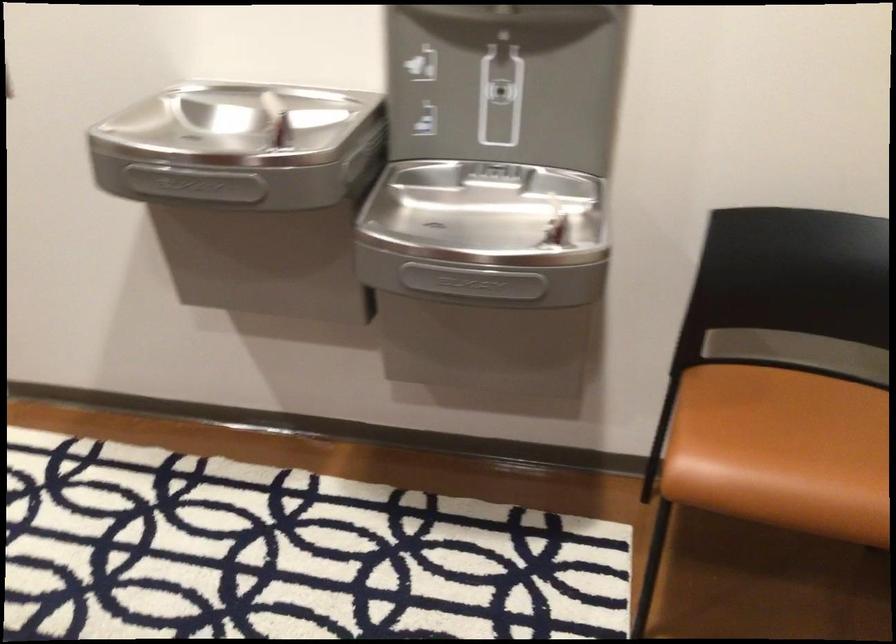
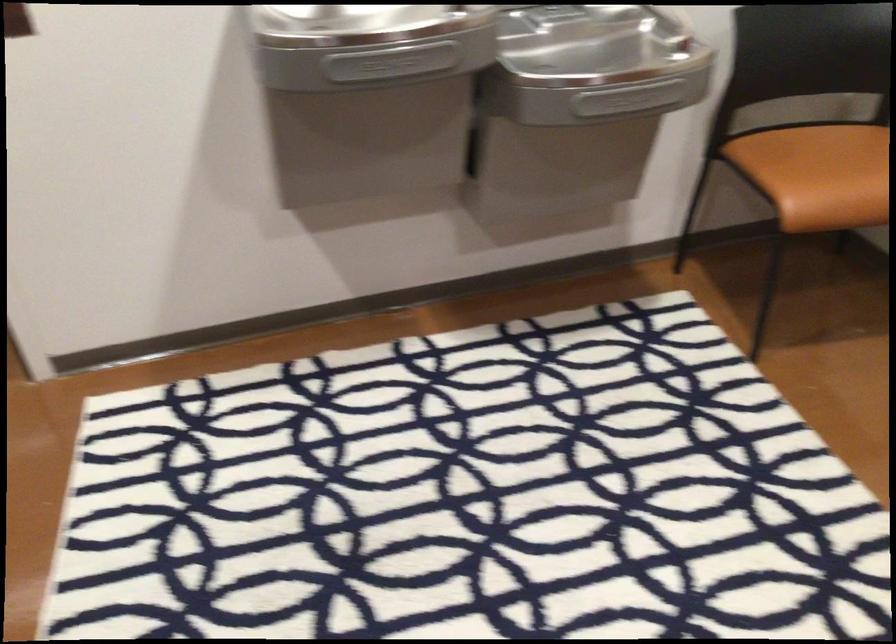
The point at [200,190] is marked in the first image. Where is the corresponding point in the second image?

(391, 62)